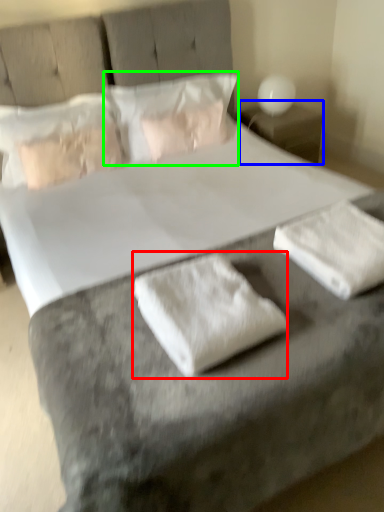
Question: Estimate the real-world distances between objects in this image. Which object is farther from material (highlighted by a red box), nightstand (highlighted by a blue box) or pillow (highlighted by a green box)?

Choices:
 (A) nightstand
 (B) pillow

Answer: (A)